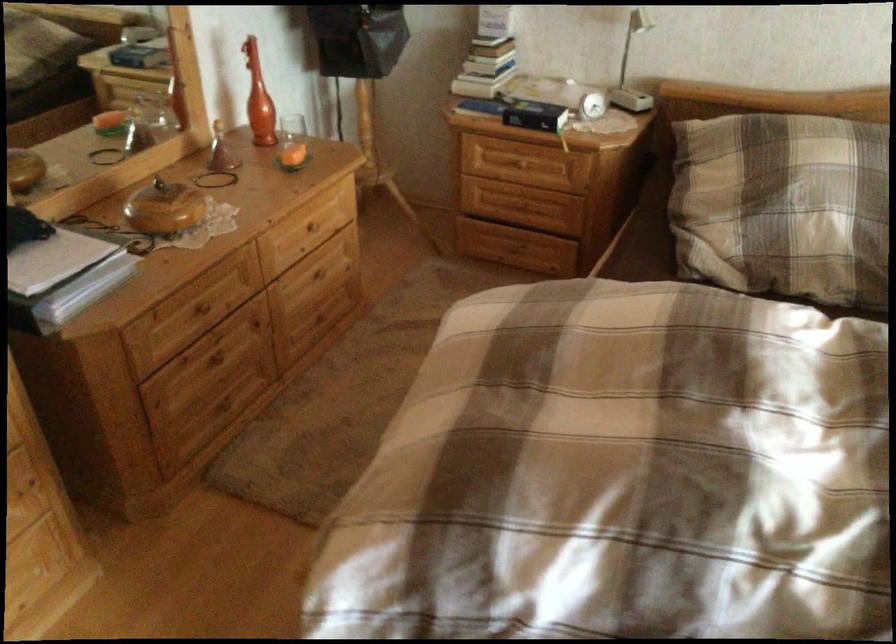
This screenshot has height=644, width=896. What are the coordinates of `glass bottle lid` in the screenshot? It's located at (165, 207).